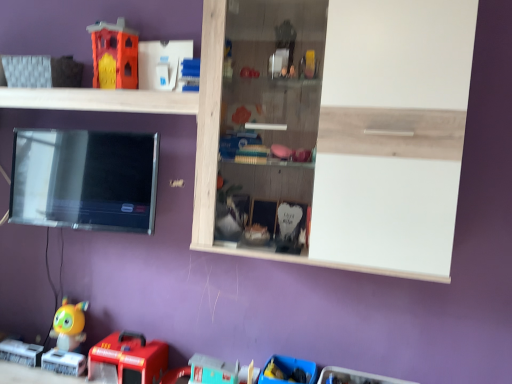
Question: Does rubberized red fire truck at lower left, the second toy from the right, turn towards white wood shelf at upper center, which is the second shelf in right-to-left order?

Choices:
 (A) no
 (B) yes

Answer: (A)

Question: Considering the relative sizes of rubberized red fire truck at lower left, the 3th toy when ordered from top to bottom, and white wood shelf at upper center, which is the second shelf in right-to-left order, in the image provided, is rubberized red fire truck at lower left, the 3th toy when ordered from top to bottom, taller than white wood shelf at upper center, which is the second shelf in right-to-left order,?

Choices:
 (A) no
 (B) yes

Answer: (B)

Question: Is rubberized red fire truck at lower left, which is counted as the third toy, starting from the left, beside white wood shelf at upper center, arranged as the first shelf when viewed from the left?

Choices:
 (A) no
 (B) yes

Answer: (A)

Question: Does rubberized red fire truck at lower left, marked as the second toy in a bottom-to-top arrangement, have a lesser height compared to white wood shelf at upper center, which is the second shelf in right-to-left order?

Choices:
 (A) yes
 (B) no

Answer: (B)

Question: Is rubberized red fire truck at lower left, marked as the second toy in a bottom-to-top arrangement, to the right of white wood shelf at upper center, which is the second shelf in right-to-left order, from the viewer's perspective?

Choices:
 (A) no
 (B) yes

Answer: (B)

Question: From a real-world perspective, relative to blue plastic toy at lower center, which ranks as the 1th toy in right-to-left order, is white wood shelf at upper center, arranged as the first shelf when viewed from the left, vertically above or below?

Choices:
 (A) above
 (B) below

Answer: (A)

Question: Is white wood shelf at upper center, arranged as the first shelf when viewed from the left, wider or thinner than blue plastic toy at lower center, the fourth toy positioned from the left?

Choices:
 (A) wide
 (B) thin

Answer: (A)

Question: Is white wood shelf at upper center, arranged as the first shelf when viewed from the left, situated inside blue plastic toy at lower center, the first toy in the bottom-to-top sequence, or outside?

Choices:
 (A) outside
 (B) inside

Answer: (A)

Question: Is point (189, 99) closer or farther from the camera than point (309, 367)?

Choices:
 (A) closer
 (B) farther

Answer: (A)

Question: Based on their sizes in the image, would you say blue plastic toy at lower center, placed as the 4th toy when sorted from top to bottom, is bigger or smaller than wooden cabinet at upper center, positioned as the first shelf in right-to-left order?

Choices:
 (A) big
 (B) small

Answer: (B)

Question: Relative to wooden cabinet at upper center, positioned as the first shelf in right-to-left order, is blue plastic toy at lower center, the first toy in the bottom-to-top sequence, in front or behind?

Choices:
 (A) front
 (B) behind

Answer: (B)

Question: Considering the positions of point (272, 372) and point (258, 38), is point (272, 372) closer or farther from the camera than point (258, 38)?

Choices:
 (A) farther
 (B) closer

Answer: (B)

Question: From the image's perspective, is blue plastic toy at lower center, which ranks as the 1th toy in right-to-left order, located above or below wooden cabinet at upper center, positioned as the 2th shelf in left-to-right order?

Choices:
 (A) below
 (B) above

Answer: (A)

Question: Looking at their shapes, would you say yellow matte toy at lower left, which appears as the third toy when ordered from the bottom, is wider or thinner than orange matte fire station at upper left, acting as the 4th toy starting from the bottom?

Choices:
 (A) thin
 (B) wide

Answer: (A)

Question: In the image, is yellow matte toy at lower left, which is the fourth toy in right-to-left order, positioned in front of or behind orange matte fire station at upper left, which appears as the first toy when viewed from the top?

Choices:
 (A) behind
 (B) front

Answer: (A)